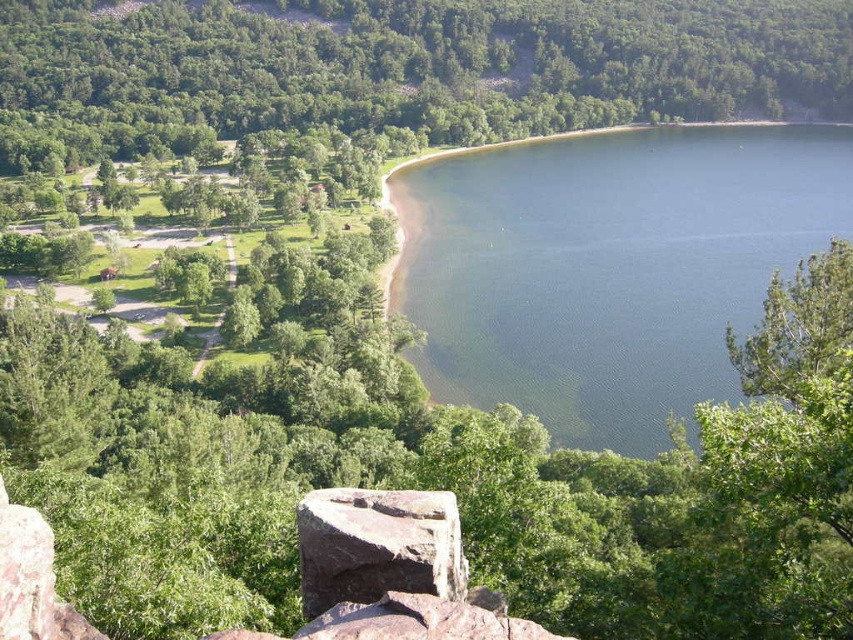
Which is below, green smooth water at center or green leafy tree at upper left?

green smooth water at center

Does point (663, 244) come closer to viewer compared to point (28, 29)?

Yes.

In order to click on green smooth water at center in this screenshot , I will do [608, 266].

Is green leafy tree at upper left wider than green leafy tree at right?

Yes, green leafy tree at upper left is wider than green leafy tree at right.

Which is in front, point (410, 1) or point (805, 284)?

Point (805, 284) is in front.

At what (x,y) coordinates should I click in order to perform the action: click on green leafy tree at upper left. Please return your answer as a coordinate pair (x, y). Looking at the image, I should click on pyautogui.click(x=422, y=61).

Find the location of a particular element. This screenshot has width=853, height=640. green leafy tree at upper left is located at coordinates (422, 61).

Where is `green smooth water at center`? Image resolution: width=853 pixels, height=640 pixels. green smooth water at center is located at coordinates (608, 266).

Locate an element on the screen. This screenshot has height=640, width=853. green smooth water at center is located at coordinates (608, 266).